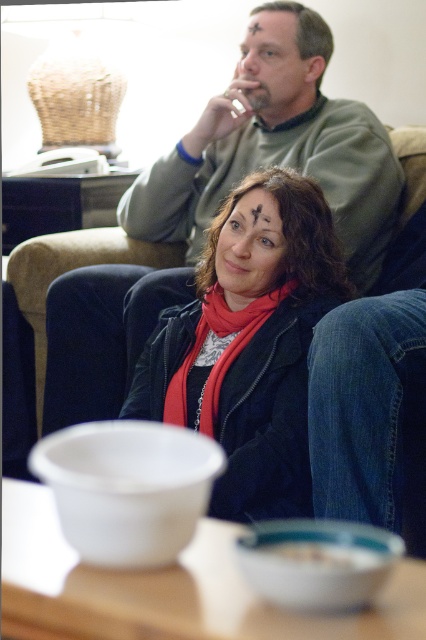
Question: Which point is closer to the camera?

Choices:
 (A) matte green sweater at center
 (B) matte black jacket at center

Answer: (B)

Question: Is matte black jacket at center to the left of red matte scarf at center from the viewer's perspective?

Choices:
 (A) no
 (B) yes

Answer: (A)

Question: Which object is positioned farthest from the red matte scarf at center?

Choices:
 (A) matte black jacket at center
 (B) matte green sweater at center

Answer: (B)

Question: Does matte black jacket at center have a greater width compared to red matte scarf at center?

Choices:
 (A) yes
 (B) no

Answer: (A)

Question: Which object is closer to the camera taking this photo?

Choices:
 (A) red matte scarf at center
 (B) matte black jacket at center

Answer: (B)

Question: Does matte green sweater at center have a greater width compared to matte black jacket at center?

Choices:
 (A) yes
 (B) no

Answer: (A)